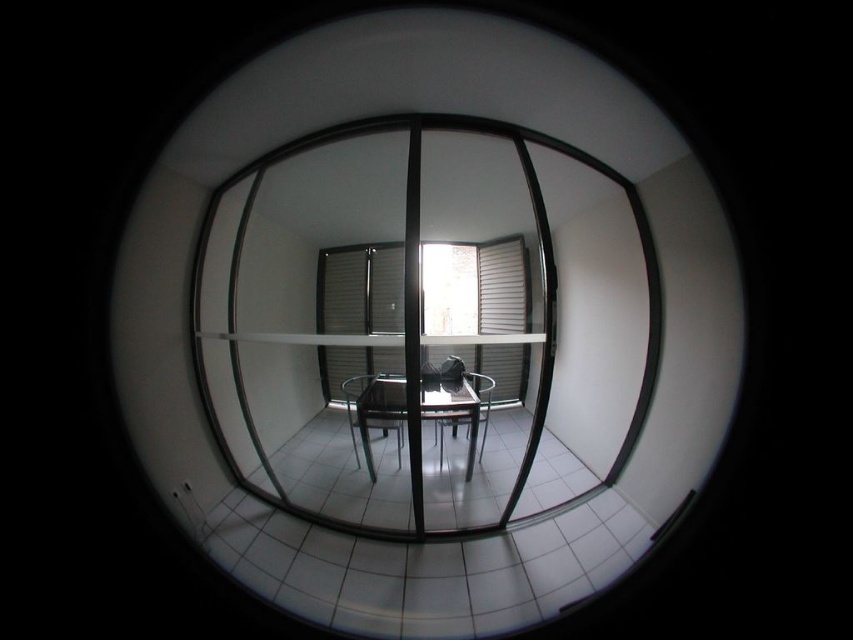
You are a delivery person trying to place a large package on the table. The package is 1.8 meters tall. Can you place it on the metallic glass table at center without it touching the transparent glass mirror at center?

The transparent glass mirror at center is much taller than the metallic glass table at center. Since the package is 1.8 meters tall, it might exceed the height of the metallic glass table at center, causing it to touch the mirror. Therefore, placing the package there may not be safe or feasible.

You are standing in the room and want to place a new plant pot on the right side of the metallic black chair at center. According to the scene description, where should you position it relative to the metallic glass table at center?

The metallic glass table at center is to the left of the metallic black chair at center, so to place the plant pot on the right side of the metallic black chair at center, position it to the right of the metallic black chair at center, which would be opposite the metallic glass table at center.

You are organizing a meeting in the room with the rectangular table. You need to seat two guests at the metallic black chair at center and the metallic silver chair at center. Which chair will require more space due to its size?

The metallic black chair at center requires more space because it has a larger size compared to the metallic silver chair at center.